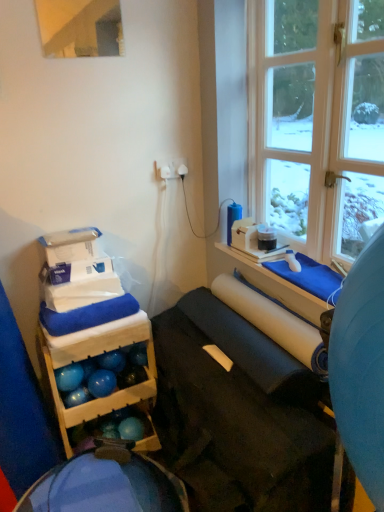
Question: Is matte black yoga mat at center bigger than white matte paper towel at center?

Choices:
 (A) no
 (B) yes

Answer: (B)

Question: Can you confirm if matte black yoga mat at center is smaller than white matte paper towel at center?

Choices:
 (A) no
 (B) yes

Answer: (A)

Question: Is matte black yoga mat at center outside of white matte paper towel at center?

Choices:
 (A) no
 (B) yes

Answer: (B)

Question: Does matte black yoga mat at center have a greater width compared to white matte paper towel at center?

Choices:
 (A) yes
 (B) no

Answer: (A)

Question: Is matte black yoga mat at center looking in the opposite direction of white matte paper towel at center?

Choices:
 (A) no
 (B) yes

Answer: (A)

Question: From the image's perspective, is matte black yoga mat at center beneath white matte paper towel at center?

Choices:
 (A) no
 (B) yes

Answer: (B)

Question: Can you confirm if matte black yoga mat at center is positioned to the left of wooden storage at left?

Choices:
 (A) yes
 (B) no

Answer: (B)

Question: Can you confirm if matte black yoga mat at center is shorter than wooden storage at left?

Choices:
 (A) no
 (B) yes

Answer: (A)

Question: From a real-world perspective, is matte black yoga mat at center below wooden storage at left?

Choices:
 (A) no
 (B) yes

Answer: (B)

Question: Can you confirm if matte black yoga mat at center is wider than wooden storage at left?

Choices:
 (A) no
 (B) yes

Answer: (B)

Question: Can you confirm if matte black yoga mat at center is smaller than wooden storage at left?

Choices:
 (A) no
 (B) yes

Answer: (A)

Question: Does matte black yoga mat at center have a lesser width compared to wooden storage at left?

Choices:
 (A) yes
 (B) no

Answer: (B)

Question: Can you confirm if blue fabric bean bag at lower left is bigger than white matte paper towel at center?

Choices:
 (A) yes
 (B) no

Answer: (A)